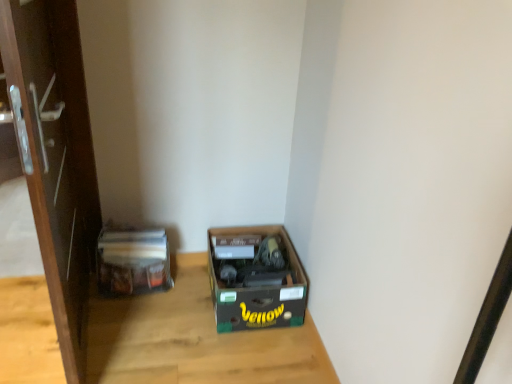
Question: In terms of width, does wooden table at center look wider or thinner when compared to brown cardboard box at lower center?

Choices:
 (A) wide
 (B) thin

Answer: (A)

Question: From a real-world perspective, is wooden table at center physically located above or below brown cardboard box at lower center?

Choices:
 (A) above
 (B) below

Answer: (B)

Question: Based on their relative distances, which object is farther from the wooden table at center?

Choices:
 (A) brown glossy door at left
 (B) matte plastic bag at left
 (C) brown cardboard box at lower center

Answer: (A)

Question: Which object is positioned farthest from the brown glossy door at left?

Choices:
 (A) wooden table at center
 (B) matte plastic bag at left
 (C) brown cardboard box at lower center

Answer: (C)